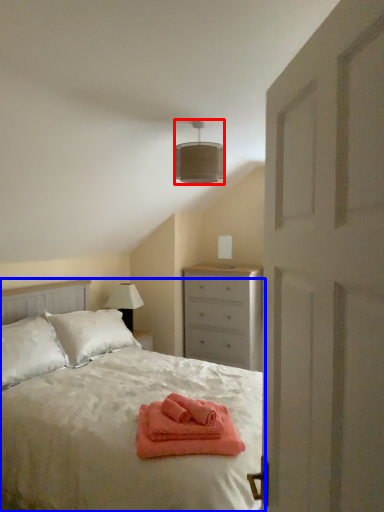
Question: Which object is closer to the camera taking this photo, lamp (highlighted by a red box) or bed (highlighted by a blue box)?

Choices:
 (A) lamp
 (B) bed

Answer: (B)